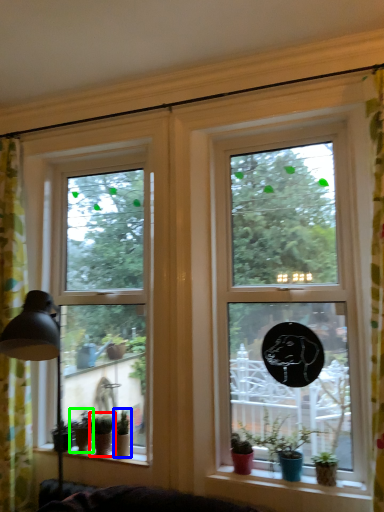
Question: Estimate the real-world distances between objects in this image. Which object is closer to houseplant (highlighted by a red box), houseplant (highlighted by a blue box) or houseplant (highlighted by a green box)?

Choices:
 (A) houseplant
 (B) houseplant

Answer: (B)